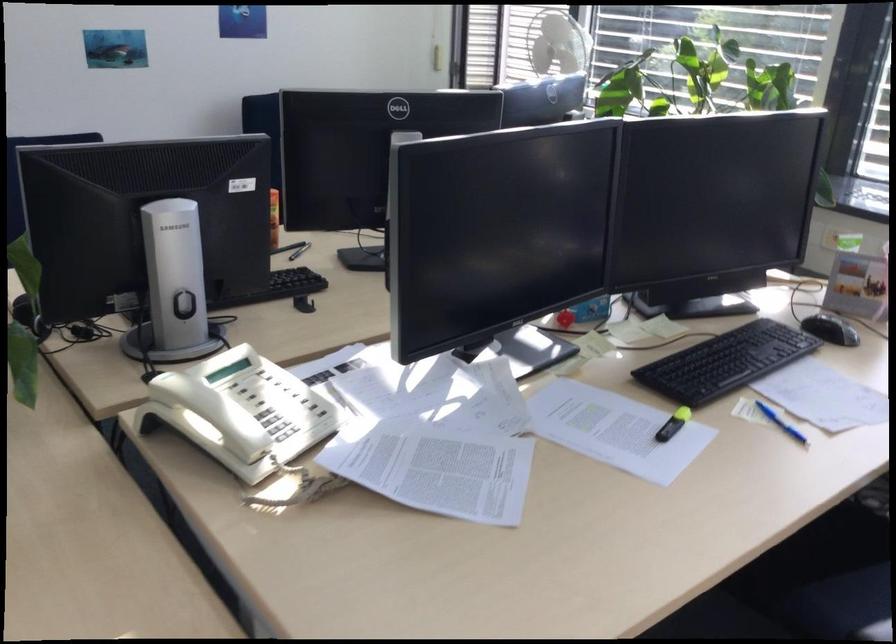
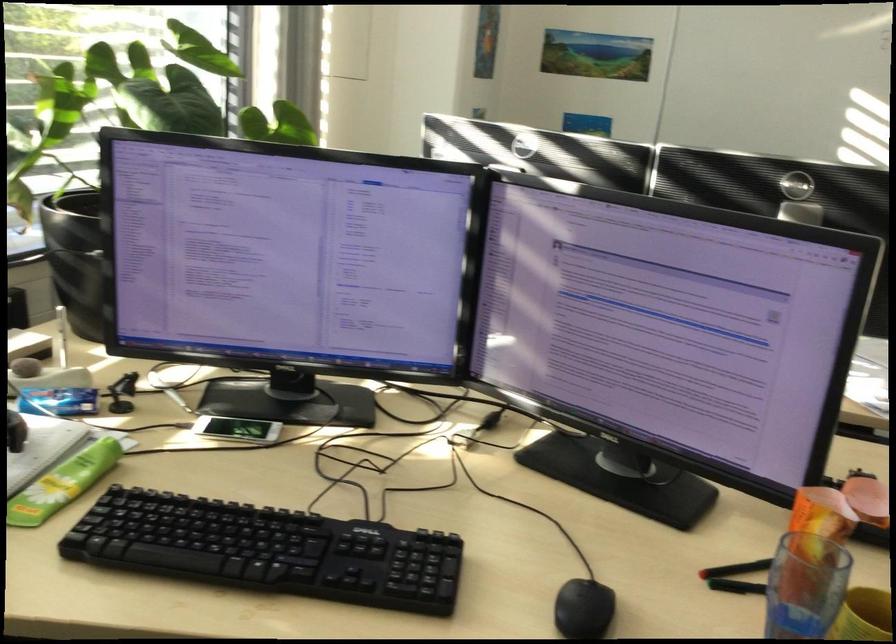
The point at (307, 146) is marked in the first image. Where is the corresponding point in the second image?

(826, 328)